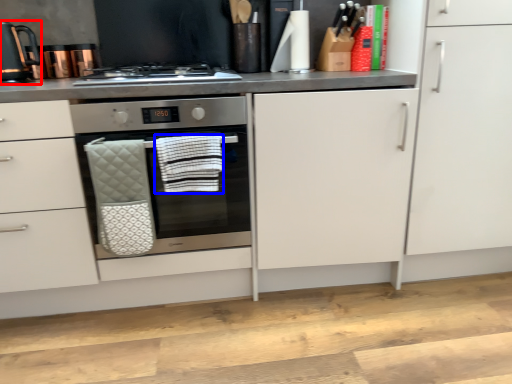
Question: Which of the following is the closest to the observer, kitchen appliance (highlighted by a red box) or hand towel (highlighted by a blue box)?

Choices:
 (A) kitchen appliance
 (B) hand towel

Answer: (B)